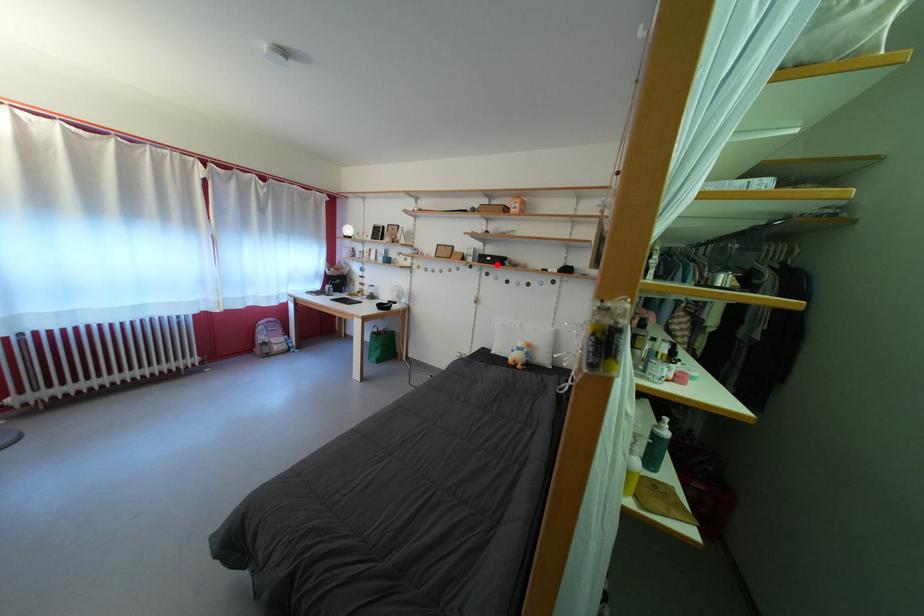
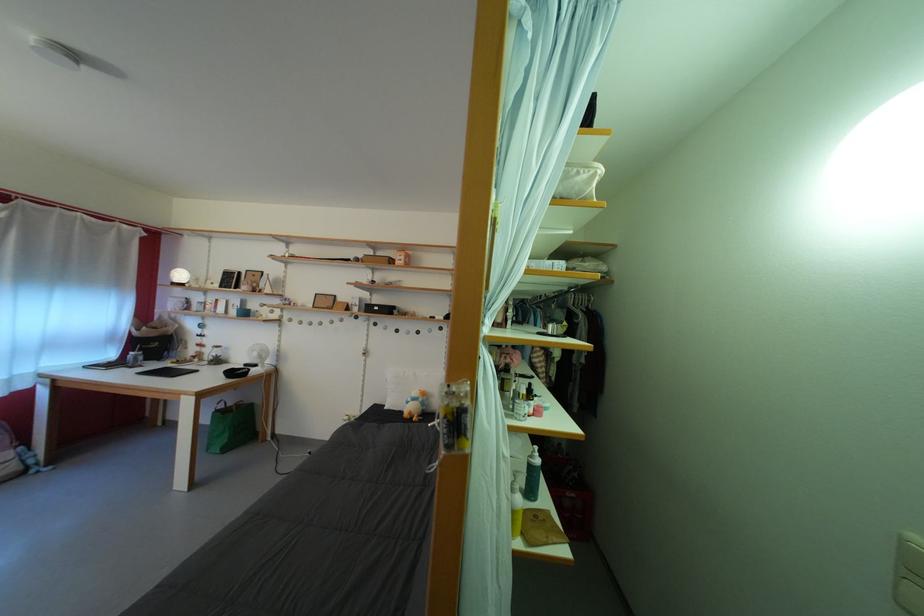
Locate, in the second image, the point that corresponds to the highlighted location in the first image.

(384, 314)